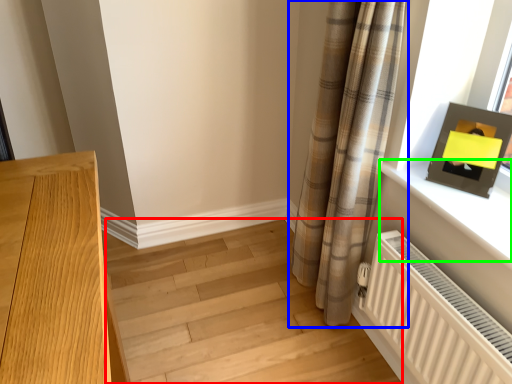
Question: Which object is the closest to the stairwell (highlighted by a red box)? Choose among these: curtain (highlighted by a blue box) or window sill (highlighted by a green box).

Choices:
 (A) curtain
 (B) window sill

Answer: (A)